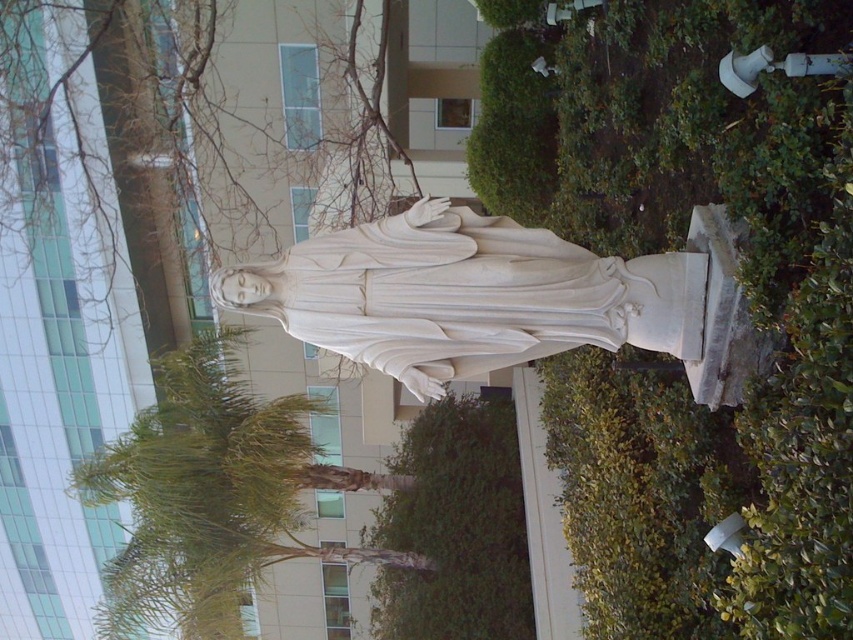
The image size is (853, 640). Identify the location of bare branches at upper center. (161, 160).

Does bare branches at upper center lie in front of green leafy bush at lower center?

No, it is behind green leafy bush at lower center.

Image resolution: width=853 pixels, height=640 pixels. I want to click on bare branches at upper center, so click(x=161, y=160).

The height and width of the screenshot is (640, 853). What are the coordinates of `bare branches at upper center` in the screenshot? It's located at (161, 160).

Does bare branches at upper center have a lesser height compared to white marble statue at center?

Indeed, bare branches at upper center has a lesser height compared to white marble statue at center.

Between bare branches at upper center and white marble statue at center, which one has less height?

bare branches at upper center

Does point (18, 260) come behind point (393, 246)?

Yes.

You are a GUI agent. You are given a task and a screenshot of the screen. Output one action in this format:
    pyautogui.click(x=<x>, y=<y>)
    Task: Click on the bare branches at upper center
    The height and width of the screenshot is (640, 853).
    Given the screenshot: What is the action you would take?
    pyautogui.click(x=161, y=160)

Between point (492, 365) and point (415, 595), which one is positioned behind?

The point (415, 595) is behind.

Can you confirm if white marble statue at center is taller than green leafy bush at lower center?

Incorrect, white marble statue at center's height is not larger of green leafy bush at lower center's.

Who is more forward, (238, 269) or (401, 586)?

Positioned in front is point (238, 269).

Image resolution: width=853 pixels, height=640 pixels. I want to click on white marble statue at center, so click(502, 298).